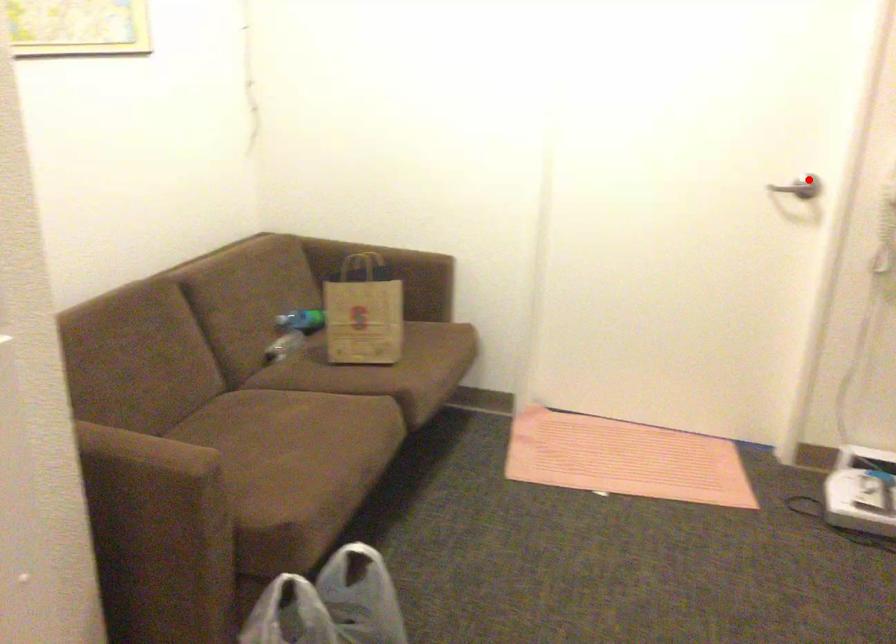
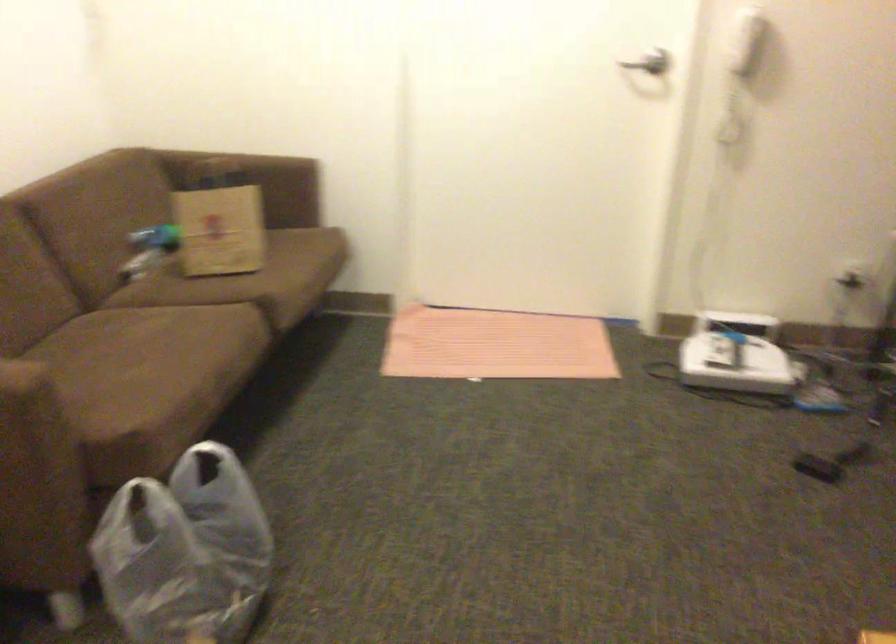
The point at the highlighted location is marked in the first image. Where is the corresponding point in the second image?

(650, 62)